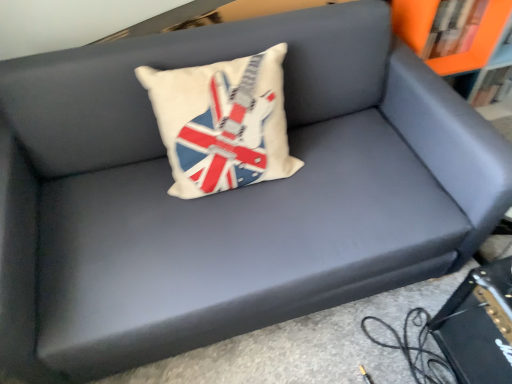
Question: Should I look upward or downward to see black leather book at lower right?

Choices:
 (A) up
 (B) down

Answer: (B)

Question: In which direction should I rotate to look at white fabric pillow with union jack design at center?

Choices:
 (A) right
 (B) left

Answer: (B)

Question: Considering the relative sizes of orange matte bookshelf at upper right and orange matte bookcase at upper right in the image provided, is orange matte bookshelf at upper right bigger than orange matte bookcase at upper right?

Choices:
 (A) yes
 (B) no

Answer: (B)

Question: Considering the relative sizes of orange matte bookshelf at upper right and orange matte bookcase at upper right in the image provided, is orange matte bookshelf at upper right thinner than orange matte bookcase at upper right?

Choices:
 (A) no
 (B) yes

Answer: (B)

Question: From the image's perspective, is orange matte bookshelf at upper right over orange matte bookcase at upper right?

Choices:
 (A) yes
 (B) no

Answer: (A)

Question: Is orange matte bookshelf at upper right closer to camera compared to orange matte bookcase at upper right?

Choices:
 (A) no
 (B) yes

Answer: (A)

Question: Is the position of orange matte bookshelf at upper right more distant than that of orange matte bookcase at upper right?

Choices:
 (A) no
 (B) yes

Answer: (B)

Question: Considering the relative sizes of orange matte bookshelf at upper right and orange matte bookcase at upper right in the image provided, is orange matte bookshelf at upper right wider than orange matte bookcase at upper right?

Choices:
 (A) no
 (B) yes

Answer: (A)

Question: Is black leather book at lower right aimed at orange matte bookshelf at upper right?

Choices:
 (A) yes
 (B) no

Answer: (B)

Question: From the image's perspective, would you say black leather book at lower right is positioned over orange matte bookshelf at upper right?

Choices:
 (A) no
 (B) yes

Answer: (A)

Question: Is black leather book at lower right outside of orange matte bookshelf at upper right?

Choices:
 (A) no
 (B) yes

Answer: (B)

Question: Considering the relative sizes of black leather book at lower right and orange matte bookshelf at upper right in the image provided, is black leather book at lower right wider than orange matte bookshelf at upper right?

Choices:
 (A) no
 (B) yes

Answer: (B)

Question: Is black leather book at lower right looking in the opposite direction of orange matte bookshelf at upper right?

Choices:
 (A) no
 (B) yes

Answer: (A)

Question: From the image's perspective, does black leather book at lower right appear lower than orange matte bookshelf at upper right?

Choices:
 (A) no
 (B) yes

Answer: (B)

Question: Does white fabric pillow with union jack design at center have a lesser width compared to black leather book at lower right?

Choices:
 (A) yes
 (B) no

Answer: (A)